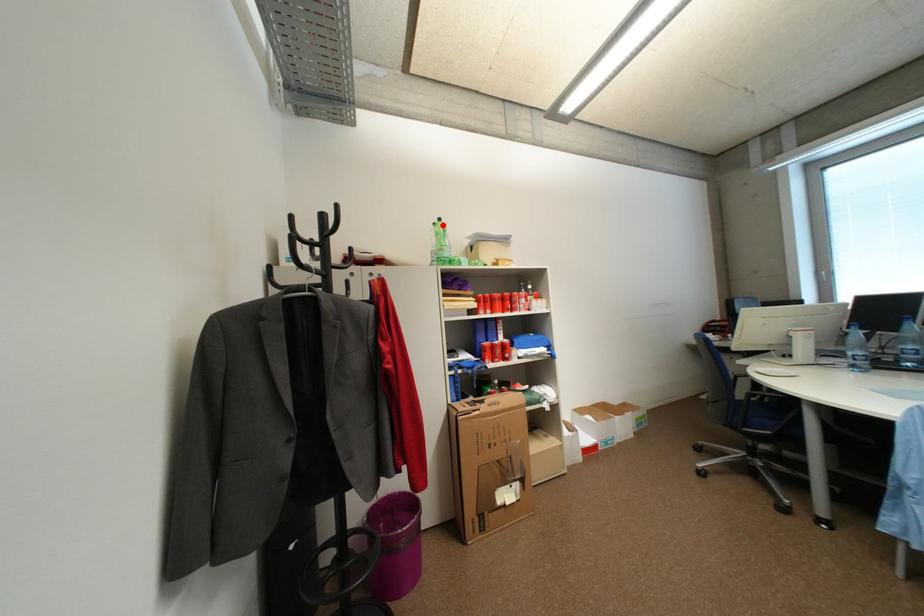
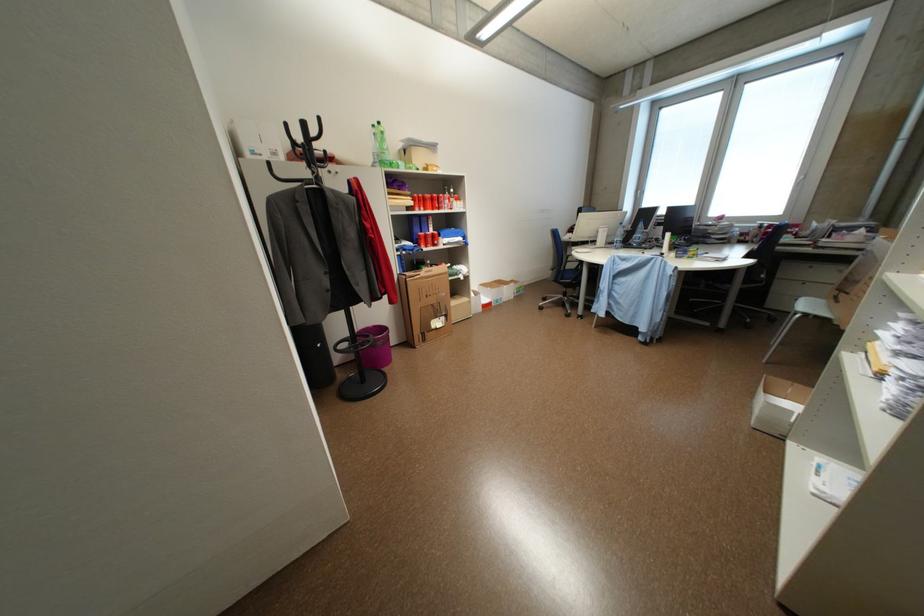
Where in the second image is the point corresponding to the highlighted location from the first image?

(382, 127)